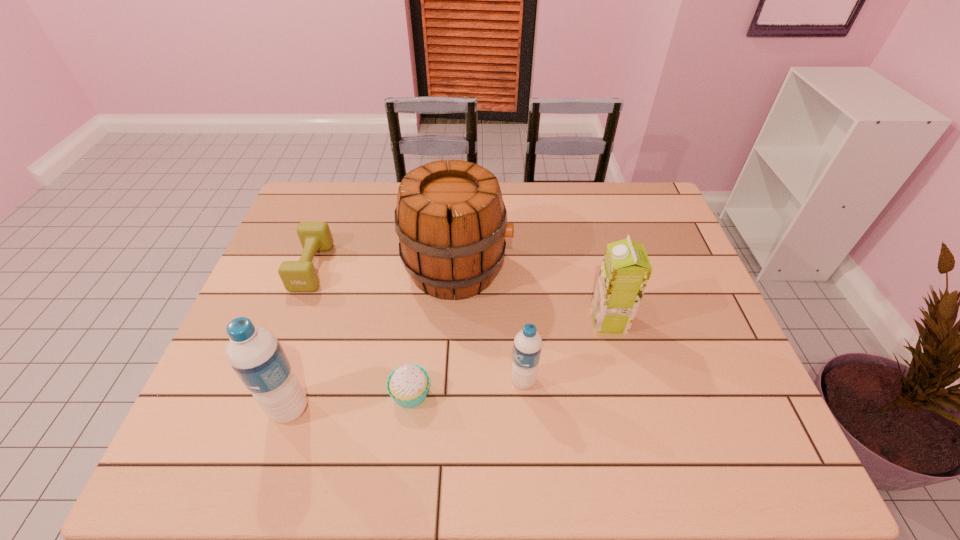
Where is `vacant area situated on the label of the left water bottle`? The image size is (960, 540). vacant area situated on the label of the left water bottle is located at coordinates 215,409.

The width and height of the screenshot is (960, 540). In order to click on vacant space located 0.180m on the label of the right water bottle in this screenshot , I will do `click(433, 381)`.

Find the location of a particular element. The height and width of the screenshot is (540, 960). vacant area located on the label of the right water bottle is located at coordinates (407, 381).

The width and height of the screenshot is (960, 540). Identify the location of free spot located 0.290m on the label of the right water bottle. (385, 381).

Locate an element on the screen. free space located on the back of the fourth nearest object is located at coordinates (589, 246).

Where is `blank space located 0.200m on the front of the shortest object`? The width and height of the screenshot is (960, 540). blank space located 0.200m on the front of the shortest object is located at coordinates (278, 355).

I want to click on vacant space located 0.130m on the side of the cider where the spigot is located, so click(556, 268).

Where is `free space located 0.190m on the back of the cupcake`? Image resolution: width=960 pixels, height=540 pixels. free space located 0.190m on the back of the cupcake is located at coordinates (420, 313).

Locate an element on the screen. This screenshot has width=960, height=540. cupcake located at the near edge is located at coordinates click(x=408, y=384).

Find the location of a particular element. The image size is (960, 540). water bottle that is at the left edge is located at coordinates (255, 354).